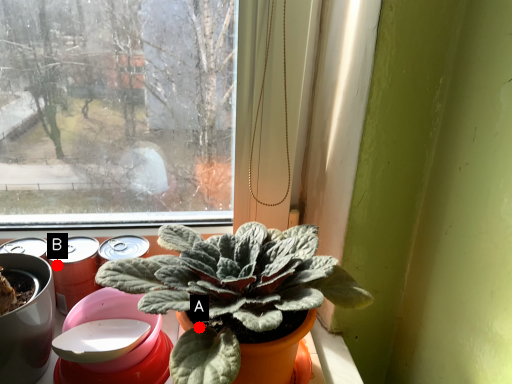
Question: Two points are circled on the image, labeled by A and B beside each circle. Which point appears closest to the camera in this image?

Choices:
 (A) A is closer
 (B) B is closer

Answer: (A)